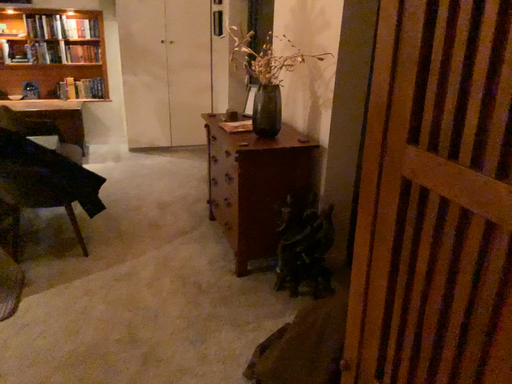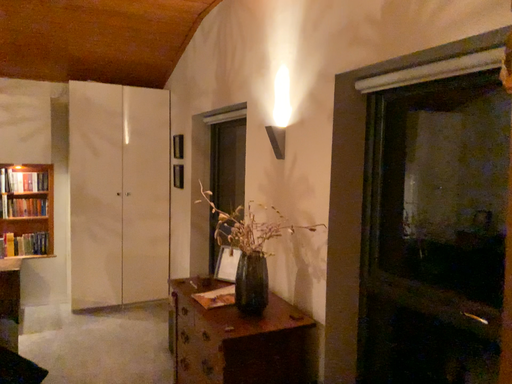
Question: How did the camera likely rotate when shooting the video?

Choices:
 (A) rotated upward
 (B) rotated downward

Answer: (A)